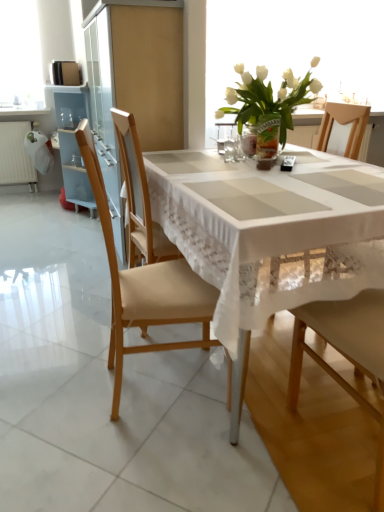
Where is `vacant area that is situated to the right of light brown wood chair at left, acting as the 2th chair starting from the right`? vacant area that is situated to the right of light brown wood chair at left, acting as the 2th chair starting from the right is located at coordinates (266, 391).